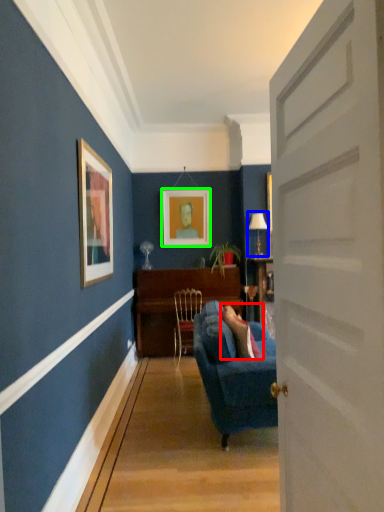
Question: Which is farther away from person (highlighted by a red box)? lamp (highlighted by a blue box) or picture frame (highlighted by a green box)?

Choices:
 (A) lamp
 (B) picture frame

Answer: (A)